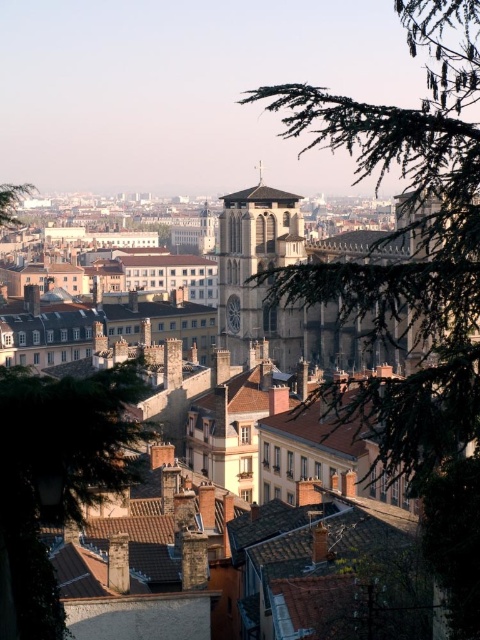
At what (x,y) coordinates should I click in order to perform the action: click on stone church at center. Please return your answer as a coordinate pair (x, y). The height and width of the screenshot is (640, 480). Looking at the image, I should click on (420, 392).

Is stone church at center positioned at the back of stone gothic cathedral at center?

That is False.

Does point (23, 385) come closer to viewer compared to point (235, 198)?

Yes, it is in front of point (235, 198).

You are a GUI agent. You are given a task and a screenshot of the screen. Output one action in this format:
    pyautogui.click(x=<x>, y=<y>)
    Task: Click on the stone church at center
    Image resolution: width=480 pixels, height=640 pixels.
    Given the screenshot: What is the action you would take?
    pyautogui.click(x=420, y=392)

The width and height of the screenshot is (480, 640). What do you see at coordinates (57, 476) in the screenshot?
I see `green leafy tree at lower left` at bounding box center [57, 476].

Which of these two, green leafy tree at lower left or green leafy tree at upper left, stands taller?

Standing taller between the two is green leafy tree at upper left.

Who is more forward, (6, 589) or (0, 205)?

Point (6, 589) is in front.

Where is `green leafy tree at lower left`? The width and height of the screenshot is (480, 640). green leafy tree at lower left is located at coordinates (57, 476).

Can you confirm if green textured tree at upper right is positioned below green leafy tree at upper left?

Actually, green textured tree at upper right is above green leafy tree at upper left.

Consider the image. Does green textured tree at upper right have a greater height compared to green leafy tree at upper left?

Indeed, green textured tree at upper right has a greater height compared to green leafy tree at upper left.

Between point (471, 573) and point (20, 189), which one is positioned behind?

The point (20, 189) is more distant.

Identify the location of green textured tree at upper right. (414, 285).